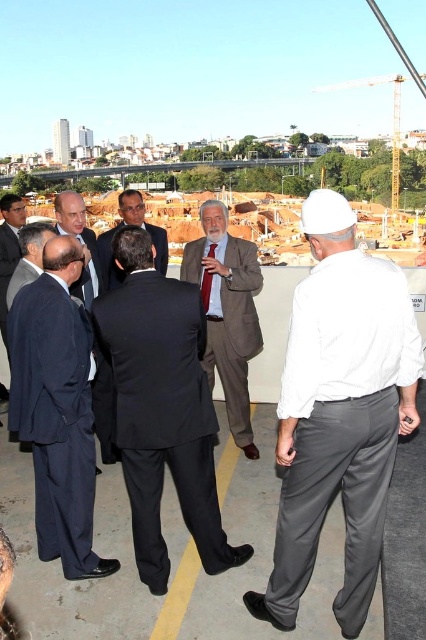
You are a construction worker standing at the edge of the construction site. You need to hand a tool to the person wearing the matte brown suit at center. Can you reach them without moving from your current position?

The matte brown suit at center is 77.65 meters away from the viewer. Since this distance is too far to reach without moving, you cannot hand the tool directly from your current position.

You are a safety inspector at the construction site. You notice two items at the center of the scene, the white matte hard hat at center and the matte brown suit at center. Which item is taller?

The white matte hard hat at center is much taller than the matte brown suit at center.

You are a construction worker wearing a white hard hat. You need to locate the matte brown suit at center. Where should you look relative to your position at point (x=227, y=312)?

The point (x=227, y=312) corresponds to the matte brown suit at center, so you are already at the location of the matte brown suit at center.